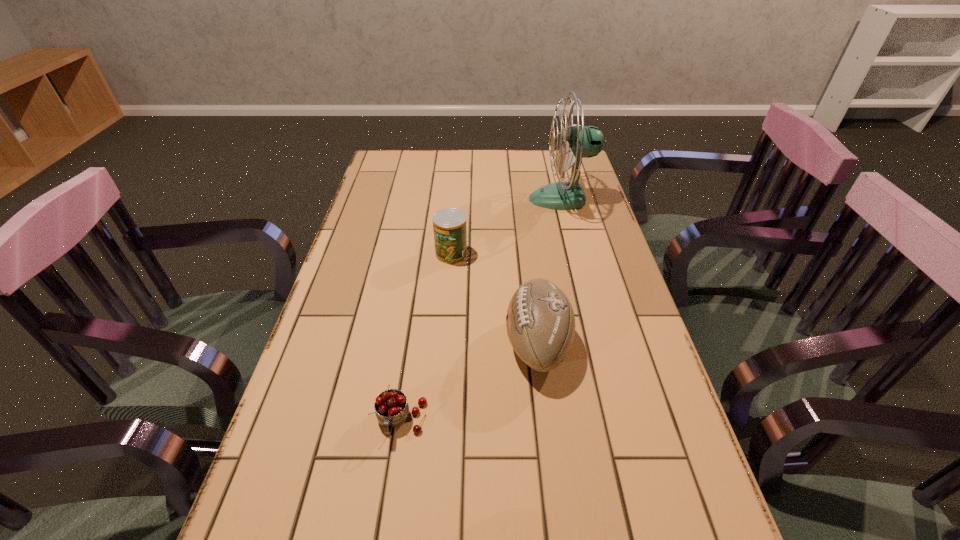
This screenshot has height=540, width=960. I want to click on free space at the left edge of the desktop, so click(324, 351).

Where is `free spot at the right edge of the desktop`? free spot at the right edge of the desktop is located at coordinates (669, 492).

The image size is (960, 540). Find the location of `vacant region at the far left corner of the desktop`. vacant region at the far left corner of the desktop is located at coordinates (389, 158).

This screenshot has width=960, height=540. I want to click on free space between the second nearest object and the fan, so click(550, 272).

Locate an element on the screen. This screenshot has height=540, width=960. free spot between the cherry and the tallest object is located at coordinates (482, 310).

The image size is (960, 540). Identify the location of free space between the shortest object and the second shortest object. (426, 337).

Where is `free space between the football (American) and the cherry`? This screenshot has height=540, width=960. free space between the football (American) and the cherry is located at coordinates click(x=469, y=382).

I want to click on blank region between the shortest object and the farthest object, so click(x=482, y=310).

Locate an element on the screen. vacant area that lies between the second nearest object and the nearest object is located at coordinates (469, 382).

Locate an element on the screen. The image size is (960, 540). vacant region between the shortest object and the football (American) is located at coordinates (469, 382).